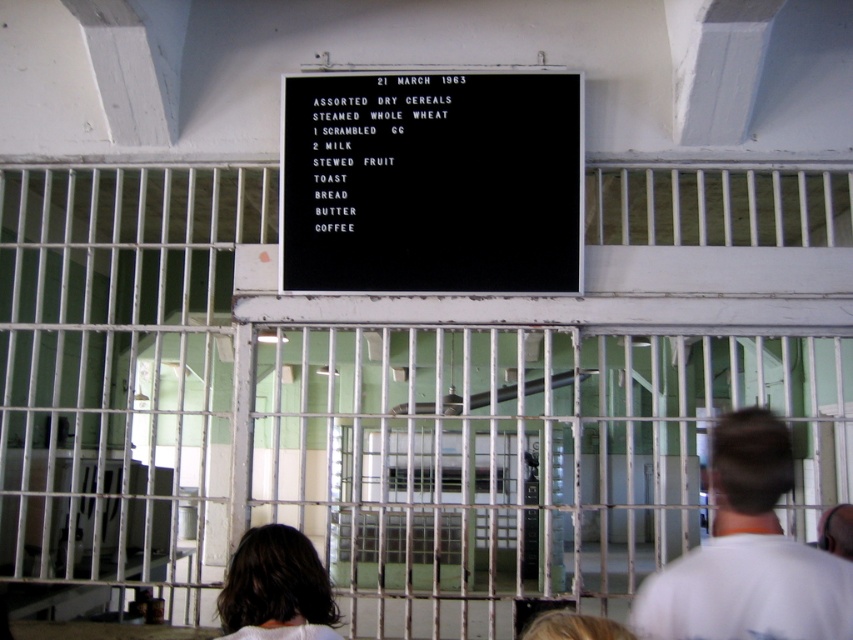
Question: Can you confirm if black paper menu at center is positioned to the right of blonde hair at lower center?

Choices:
 (A) no
 (B) yes

Answer: (A)

Question: Which is farther from the white metal bars at center?

Choices:
 (A) black plastic signboard at center
 (B) dark brown hair at lower left

Answer: (B)

Question: Does black plastic signboard at center have a lesser width compared to black paper menu at center?

Choices:
 (A) yes
 (B) no

Answer: (B)

Question: Where is black paper menu at center located in relation to blonde hair at lower center in the image?

Choices:
 (A) right
 (B) left

Answer: (B)

Question: Which point appears farthest from the camera in this image?

Choices:
 (A) (128, 556)
 (B) (408, 134)

Answer: (A)

Question: Among these objects, which one is nearest to the camera?

Choices:
 (A) white t-shirt at right
 (B) black paper menu at center

Answer: (A)